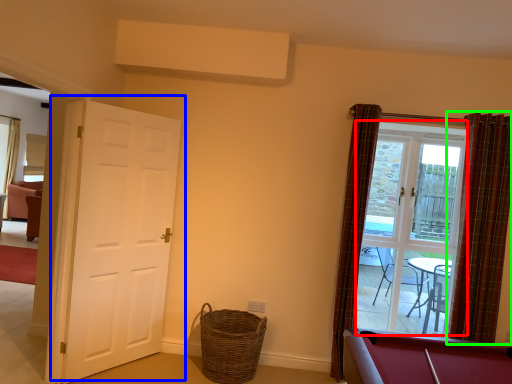
Question: Which object is positioned farthest from glass door (highlighted by a red box)? Select from door (highlighted by a blue box) and curtain (highlighted by a green box).

Choices:
 (A) door
 (B) curtain

Answer: (A)